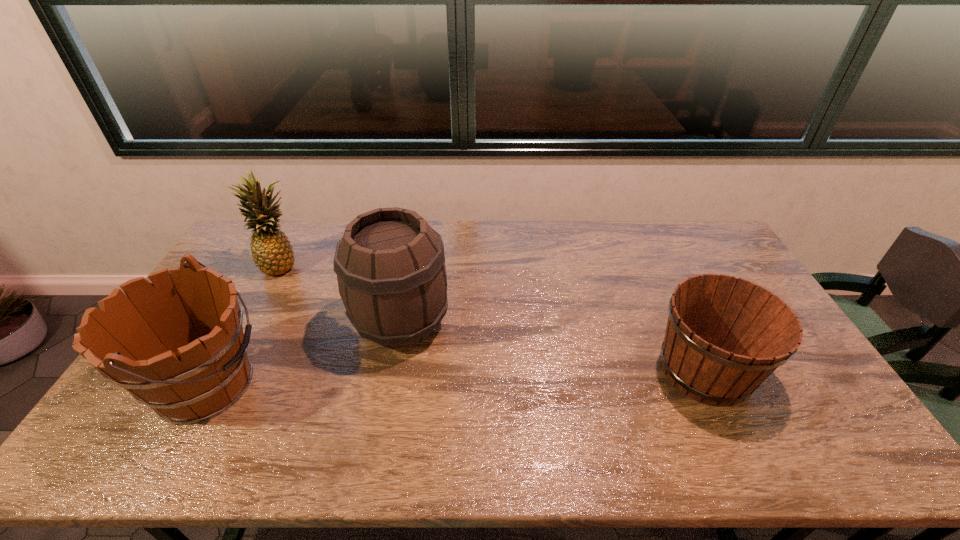
The height and width of the screenshot is (540, 960). Identify the location of object that is the closest one to the second wine bucket from left to right. (177, 345).

You are a GUI agent. You are given a task and a screenshot of the screen. Output one action in this format:
    pyautogui.click(x=<x>, y=<y>)
    Task: Click on the wine bucket that is the closest one to the rightmost object
    
    Given the screenshot: What is the action you would take?
    pyautogui.click(x=390, y=264)

Identify which wine bucket is the second closest to the second object from right to left. Please provide its 2D coordinates. Your answer should be formatted as a tuple, i.e. [(x, y)], where the tuple contains the x and y coordinates of a point satisfying the conditions above.

[(725, 335)]

Where is `vacant space that satisfies the following two spatial constraints: 1. on the front side of the second object from right to left; 2. with the handle on the leftmost wine bucket`? This screenshot has width=960, height=540. vacant space that satisfies the following two spatial constraints: 1. on the front side of the second object from right to left; 2. with the handle on the leftmost wine bucket is located at coordinates (390, 386).

I want to click on blank space that satisfies the following two spatial constraints: 1. on the front side of the farthest object; 2. on the right side of the shortest object, so click(227, 370).